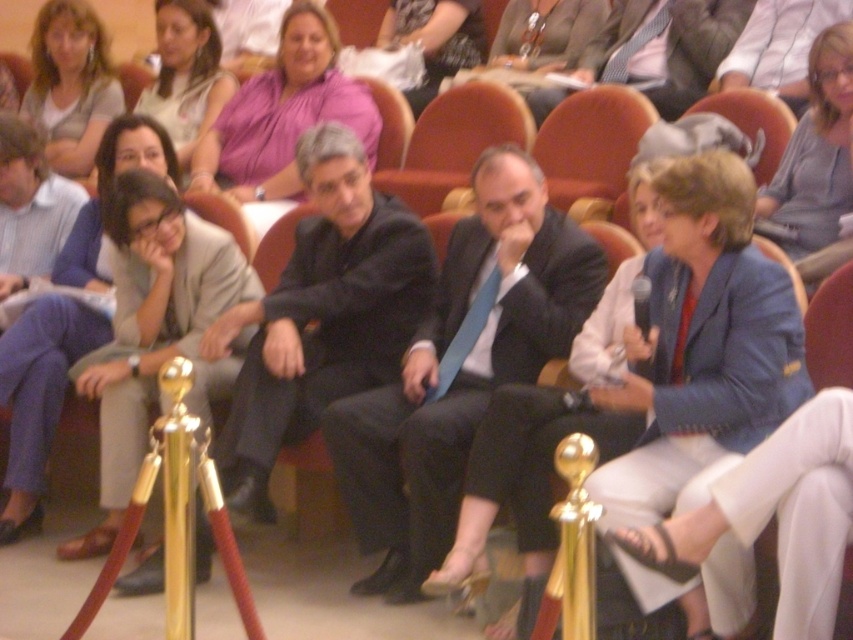
Question: Which point appears farthest from the camera in this image?

Choices:
 (A) (337, 88)
 (B) (120, 406)
 (C) (53, 134)
 (D) (477, 272)

Answer: (C)

Question: Which of the following is the closest to the observer?

Choices:
 (A) matte gray blouse at upper left
 (B) matte pink blouse at upper center
 (C) purple satin blouse at upper center
 (D) blue fabric jacket at center

Answer: (D)

Question: Can you confirm if purple satin blouse at upper center is wider than matte pink blouse at upper left?

Choices:
 (A) yes
 (B) no

Answer: (A)

Question: Is matte gray blazer at left further to camera compared to matte pink blouse at upper center?

Choices:
 (A) no
 (B) yes

Answer: (A)

Question: Among these objects, which one is nearest to the camera?

Choices:
 (A) light gray sweater at center
 (B) black suit at center

Answer: (B)

Question: Does matte blue blazer at center lie behind matte gray blouse at upper left?

Choices:
 (A) yes
 (B) no

Answer: (B)